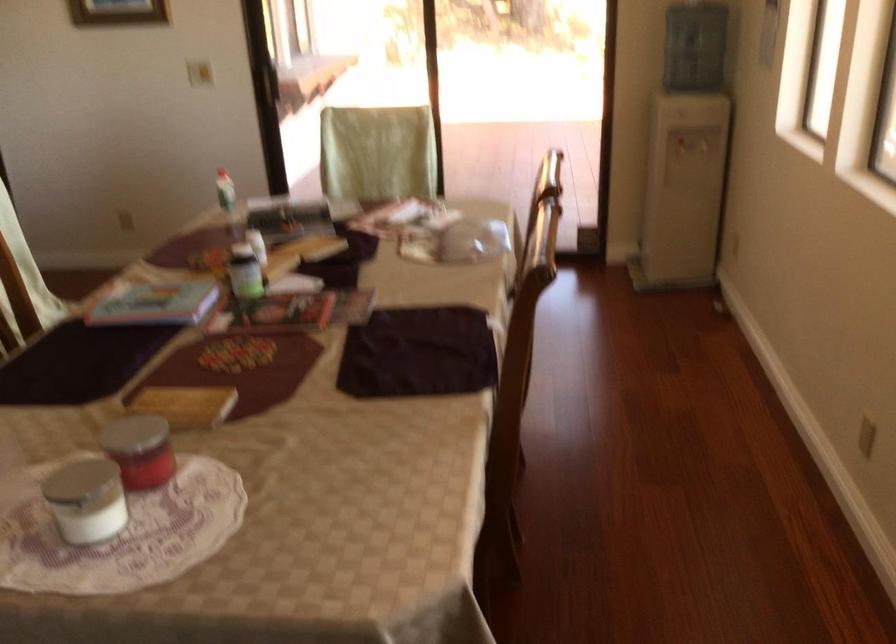
What do you see at coordinates (280, 88) in the screenshot? The height and width of the screenshot is (644, 896). I see `the red dispenser tap` at bounding box center [280, 88].